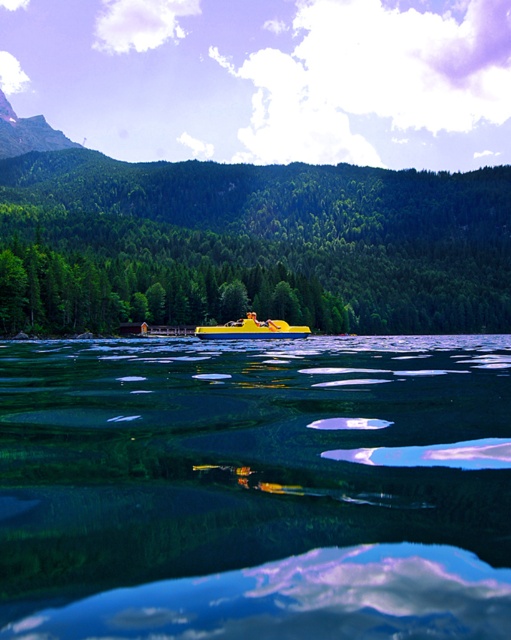
You are an environmental scientist assessing the ecological impact of the lake. You observe the yellow plastic boat at upper center and the green matte tree at center. Which object takes up more area in the scene?

The green matte tree at center occupies more area than the yellow plastic boat at upper center.

You are standing on the lakeside dock and see the green matte tree at center and the yellow matte boat at center. Which object is positioned to the left of the other?

The green matte tree at center is positioned to the left of the yellow matte boat at center.

Based on the photo, you are planning to take a photo of the green matte tree at center and the yellow matte boat at center from the lakeside. Which object will appear larger in the photo?

The green matte tree at center will appear larger in the photo because it is bigger than the yellow matte boat at center.